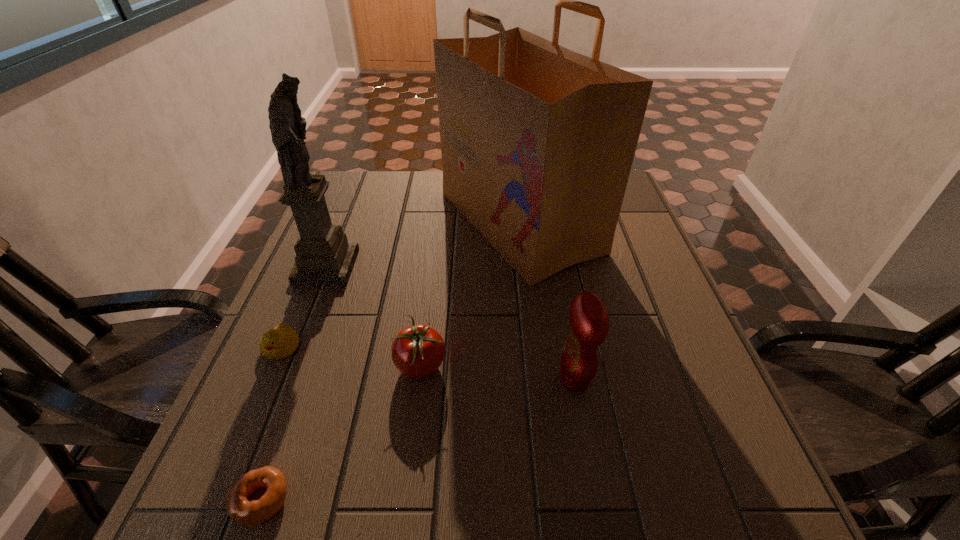
The height and width of the screenshot is (540, 960). I want to click on grocery bag, so click(537, 141).

The height and width of the screenshot is (540, 960). What are the coordinates of `sculpture` in the screenshot? It's located at (324, 256).

Find the location of a particular element. the fourth shortest object is located at coordinates (589, 320).

Locate an element on the screen. The height and width of the screenshot is (540, 960). tomato is located at coordinates (417, 351).

The height and width of the screenshot is (540, 960). I want to click on the fifth tallest object, so click(282, 341).

The image size is (960, 540). Identify the location of doughnut. (249, 513).

This screenshot has height=540, width=960. In order to click on the nearest object in this screenshot , I will do `click(249, 513)`.

Find the location of a particular element. Image resolution: width=960 pixels, height=540 pixels. vacant space situated on the side of the grocery bag with the superhero design is located at coordinates (328, 222).

Find the location of a particular element. This screenshot has height=540, width=960. vacant position located on the side of the grocery bag with the superhero design is located at coordinates (388, 222).

Locate an element on the screen. The image size is (960, 540). free space located 0.080m on the side of the grocery bag with the superhero design is located at coordinates (412, 222).